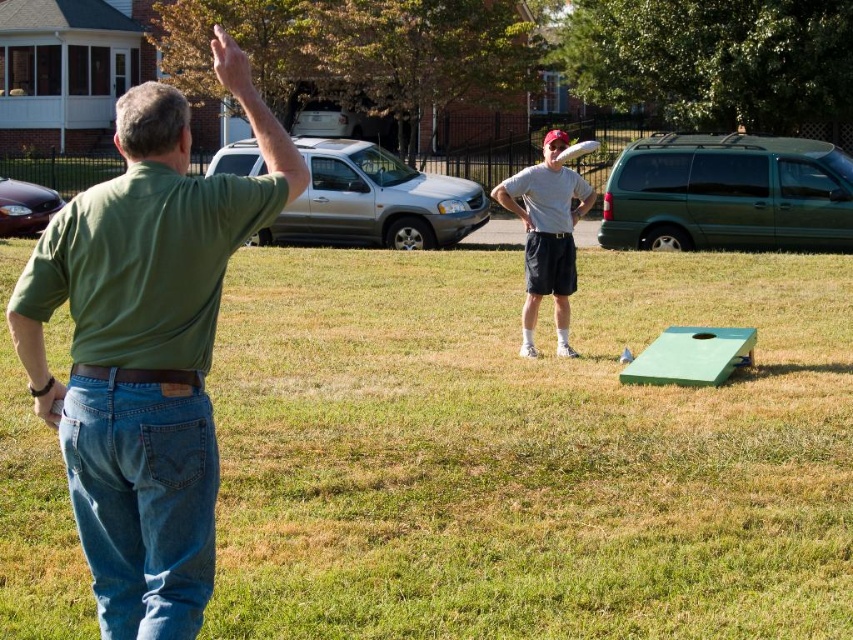
Question: Is green matte board at center to the left of green matte shirt at left from the viewer's perspective?

Choices:
 (A) yes
 (B) no

Answer: (A)

Question: Which of these objects is positioned closest to the white matte frisbee at center?

Choices:
 (A) light gray t-shirt at center
 (B) green matte shirt at left

Answer: (A)

Question: Is green matte shirt at left further to camera compared to white matte frisbee at center?

Choices:
 (A) no
 (B) yes

Answer: (A)

Question: Among these objects, which one is nearest to the camera?

Choices:
 (A) green matte board at center
 (B) green matte shirt at left
 (C) white matte frisbee at center
 (D) light gray t-shirt at center

Answer: (B)

Question: Which of the following is the farthest from the observer?

Choices:
 (A) light gray t-shirt at center
 (B) white matte frisbee at center
 (C) green matte shirt at left
 (D) green matte board at center

Answer: (A)

Question: Can you confirm if green matte shirt at left is positioned above white matte frisbee at center?

Choices:
 (A) no
 (B) yes

Answer: (A)